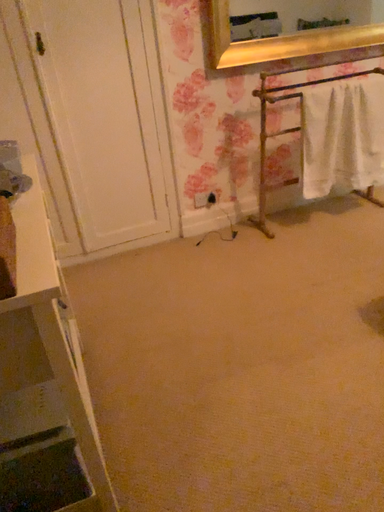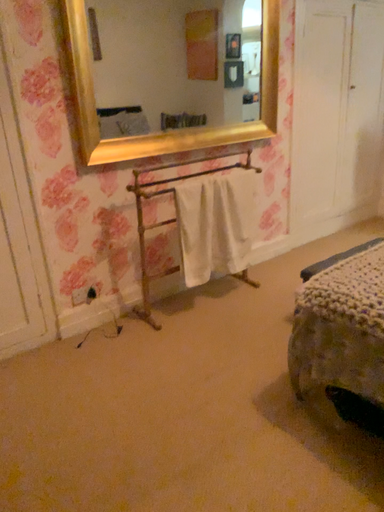
Question: How did the camera likely rotate when shooting the video?

Choices:
 (A) rotated right
 (B) rotated left

Answer: (A)